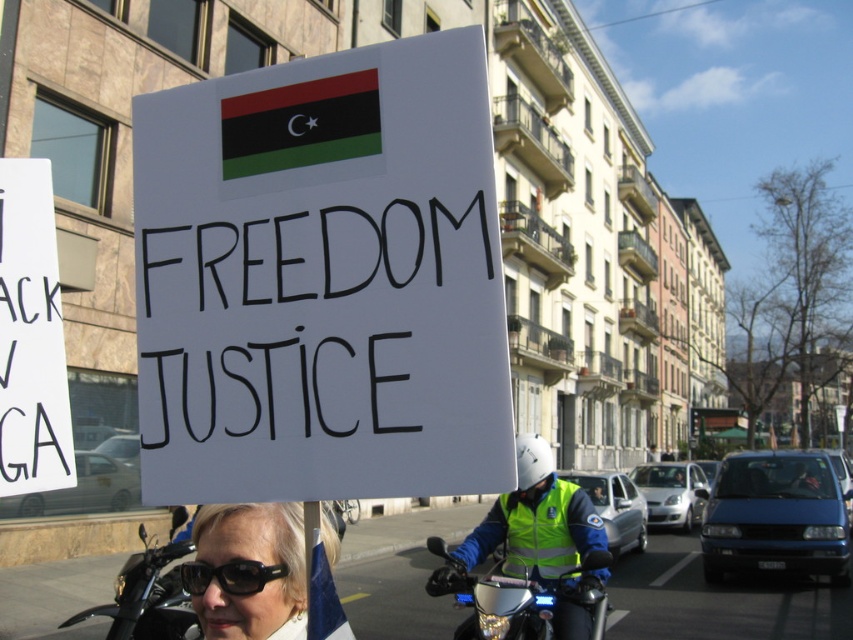
You are a photographer standing in front of the scene. You want to take a clear photo of the matte black sunglasses at lower left without any obstruction. Is the distance sufficient for a clear shot?

The matte black sunglasses at lower left is 3.49 feet away from viewer, so yes, the distance is sufficient for a clear photo without obstruction.

You are a photographer trying to capture the protestor holding the white paper sign at center and the black reflective sunglasses at center. Which object should you focus on first if you want to ensure both are in focus?

The white paper sign at center is above black reflective sunglasses at center, so you should focus on the white paper sign at center first as it is closer to the camera.